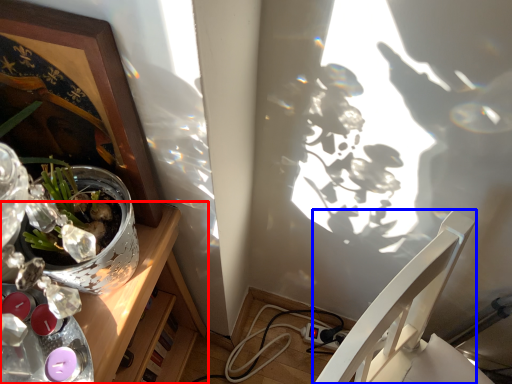
Question: Which object appears farthest to the camera in this image, desk (highlighted by a red box) or chair (highlighted by a blue box)?

Choices:
 (A) desk
 (B) chair

Answer: (A)